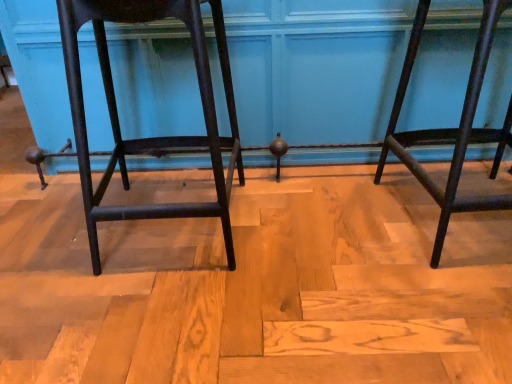
What are the coordinates of `free space to the left of matte black stool at left, positioned as the 2th furniture in right-to-left order` in the screenshot? It's located at (46, 229).